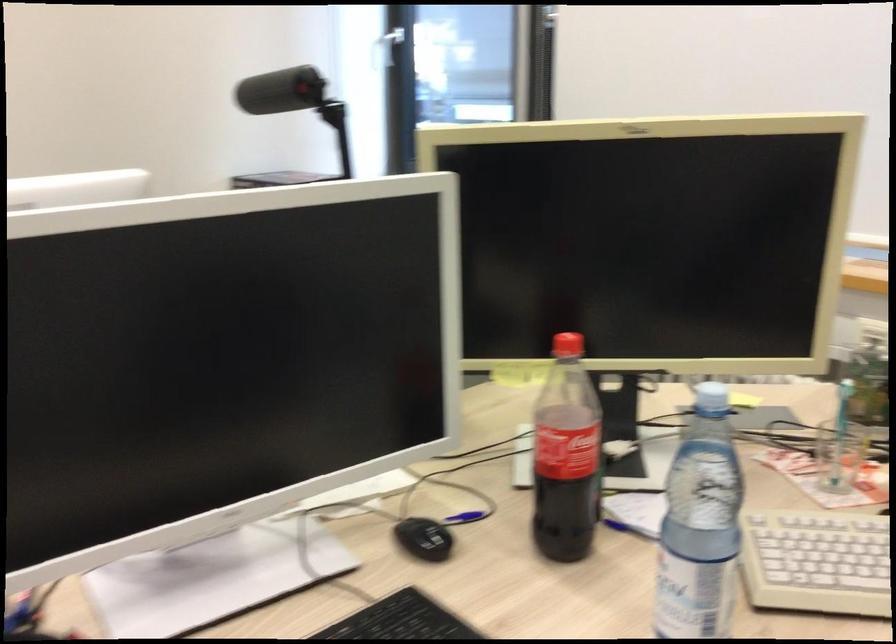
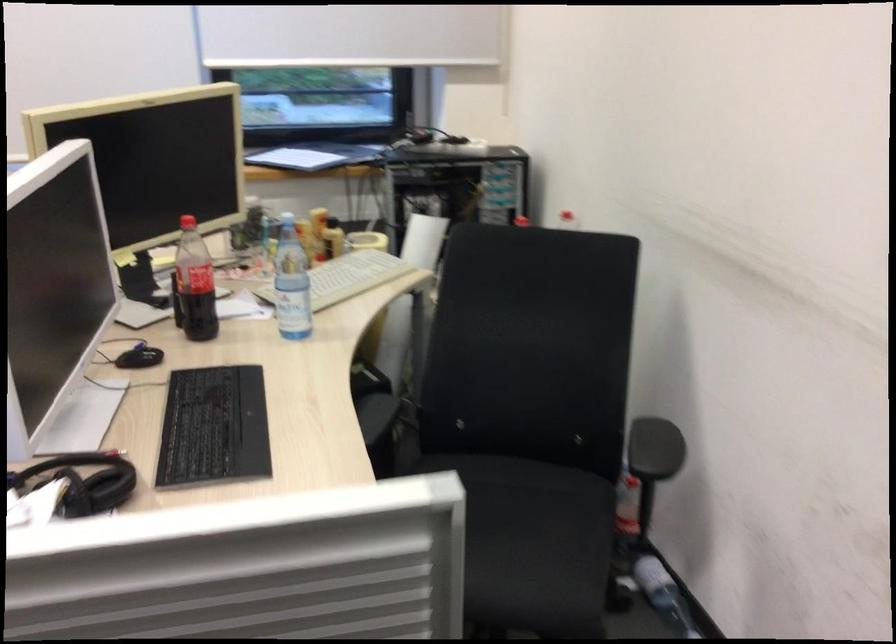
In the second image, find the point that corresponds to point (573, 456) in the first image.

(194, 283)